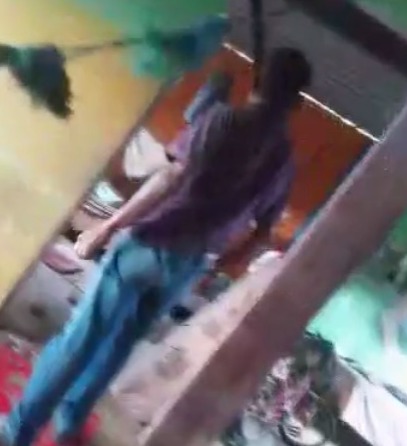
The image size is (407, 446). What are the coordinates of `orange wall` in the screenshot? It's located at (322, 141).